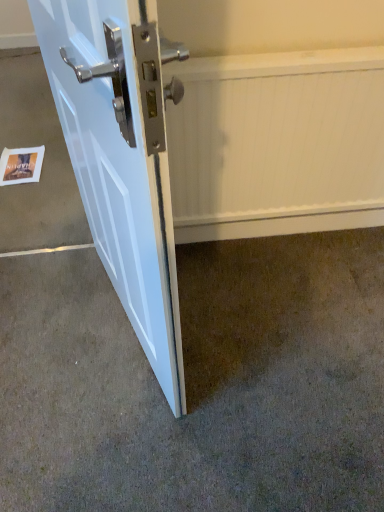
Looking at this image, what is the approximate height of white paper postcard at lower left?

The height of white paper postcard at lower left is 0.80 inches.

Image resolution: width=384 pixels, height=512 pixels. What are the coordinates of `brown carpet at lower left` in the screenshot? It's located at (199, 382).

Considering the relative sizes of white paper postcard at lower left and white textured radiator at center in the image provided, is white paper postcard at lower left bigger than white textured radiator at center?

No, white paper postcard at lower left is not bigger than white textured radiator at center.

Considering the positions of objects white paper postcard at lower left and white textured radiator at center in the image provided, who is more to the left, white paper postcard at lower left or white textured radiator at center?

Positioned to the left is white paper postcard at lower left.

In the scene shown: Is white paper postcard at lower left oriented towards white textured radiator at center?

No.

Considering the sizes of objects white paper postcard at lower left and white textured radiator at center in the image provided, who is wider, white paper postcard at lower left or white textured radiator at center?

white paper postcard at lower left.

The width and height of the screenshot is (384, 512). In the image, there is a brown carpet at lower left. What are the coordinates of `door above it (from the image's perspective)` in the screenshot? It's located at click(x=121, y=158).

From the image's perspective, which one is positioned lower, brown carpet at lower left or white glossy door at lower left?

brown carpet at lower left.

Choose the correct answer: Is brown carpet at lower left inside white glossy door at lower left or outside it?

brown carpet at lower left is not inside white glossy door at lower left, it's outside.

Considering the sizes of white textured radiator at center and white glossy door at lower left in the image, is white textured radiator at center taller or shorter than white glossy door at lower left?

In the image, white textured radiator at center appears to be shorter than white glossy door at lower left.

Which point is more distant from viewer, (234, 192) or (110, 120)?

The point (234, 192) is farther.

Is white textured radiator at center spatially inside white glossy door at lower left, or outside of it?

white textured radiator at center is spatially situated outside white glossy door at lower left.

In the scene shown: From a real-world perspective, is white paper postcard at lower left under white glossy door at lower left?

Yes.

Between white paper postcard at lower left and white glossy door at lower left, which one has larger size?

white glossy door at lower left.

Image resolution: width=384 pixels, height=512 pixels. In order to click on postcard lying on the left of white glossy door at lower left in this screenshot , I will do `click(21, 165)`.

Considering the positions of points (32, 167) and (95, 32), is point (32, 167) farther from camera compared to point (95, 32)?

That is True.

From a real-world perspective, is white glossy door at lower left positioned above or below white paper postcard at lower left?

From a real-world perspective, white glossy door at lower left is physically above white paper postcard at lower left.

Is white paper postcard at lower left at the back of white glossy door at lower left?

white glossy door at lower left does not have its back to white paper postcard at lower left.

From the image's perspective, between white glossy door at lower left and white paper postcard at lower left, who is located below?

white glossy door at lower left.

Between brown carpet at lower left and white paper postcard at lower left, which one has less height?

Standing shorter between the two is white paper postcard at lower left.

Is brown carpet at lower left located outside white paper postcard at lower left?

Yes, brown carpet at lower left is outside of white paper postcard at lower left.

Can you confirm if brown carpet at lower left is smaller than white paper postcard at lower left?

No, brown carpet at lower left is not smaller than white paper postcard at lower left.

Considering the sizes of brown carpet at lower left and white paper postcard at lower left in the image, is brown carpet at lower left wider or thinner than white paper postcard at lower left?

In the image, brown carpet at lower left appears to be wider than white paper postcard at lower left.

Looking at this image, looking at the image, does white glossy door at lower left seem bigger or smaller compared to brown carpet at lower left?

Considering their sizes, white glossy door at lower left takes up more space than brown carpet at lower left.

Does point (135, 196) lie behind point (262, 495)?

No.

Which object is wider, white glossy door at lower left or brown carpet at lower left?

brown carpet at lower left is wider.

Measure the distance between white glossy door at lower left and brown carpet at lower left.

The distance of white glossy door at lower left from brown carpet at lower left is 48.50 centimeters.

This screenshot has width=384, height=512. In the image, there is a white paper postcard at lower left. In order to click on radiator below it (from the image's perspective) in this screenshot , I will do `click(277, 143)`.

Identify the location of door positioned vertically above the brown carpet at lower left (from a real-world perspective). This screenshot has width=384, height=512. (121, 158).

When comparing their distances from brown carpet at lower left, does white textured radiator at center or white paper postcard at lower left seem closer?

white textured radiator at center.

Based on their spatial positions, is white glossy door at lower left or brown carpet at lower left further from white paper postcard at lower left?

Among the two, brown carpet at lower left is located further to white paper postcard at lower left.

Based on their spatial positions, is white textured radiator at center or white glossy door at lower left further from brown carpet at lower left?

The object further to brown carpet at lower left is white textured radiator at center.

Based on their spatial positions, is white paper postcard at lower left or white glossy door at lower left closer to white textured radiator at center?

white glossy door at lower left is positioned closer to the anchor white textured radiator at center.

Estimate the real-world distances between objects in this image. Which object is further from brown carpet at lower left, white paper postcard at lower left or white textured radiator at center?

white paper postcard at lower left.

Estimate the real-world distances between objects in this image. Which object is closer to white paper postcard at lower left, white textured radiator at center or brown carpet at lower left?

The object closer to white paper postcard at lower left is brown carpet at lower left.

From the image, which object appears to be nearer to white glossy door at lower left, brown carpet at lower left or white textured radiator at center?

brown carpet at lower left lies closer to white glossy door at lower left than the other object.

When comparing their distances from white textured radiator at center, does white glossy door at lower left or white paper postcard at lower left seem closer?

The object closer to white textured radiator at center is white glossy door at lower left.

At what (x,y) coordinates should I click in order to perform the action: click on concrete positioned between white glossy door at lower left and white paper postcard at lower left from near to far. Please return your answer as a coordinate pair (x, y). Image resolution: width=384 pixels, height=512 pixels. Looking at the image, I should click on (199, 382).

Identify the location of concrete located between white glossy door at lower left and white textured radiator at center in the depth direction. This screenshot has height=512, width=384. (199, 382).

Image resolution: width=384 pixels, height=512 pixels. What are the coordinates of `radiator between white glossy door at lower left and white paper postcard at lower left along the z-axis` in the screenshot? It's located at (277, 143).

Identify the location of concrete located between white paper postcard at lower left and white textured radiator at center in the left-right direction. The height and width of the screenshot is (512, 384). (199, 382).